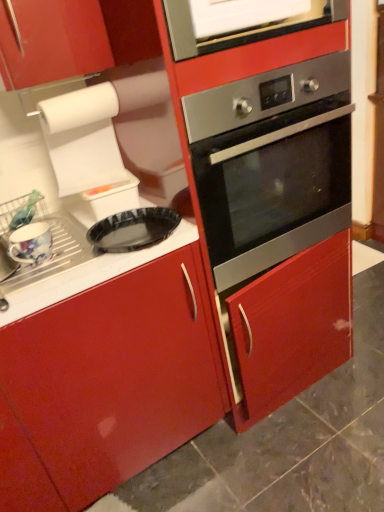
Question: Considering their positions, is stainless steel oven at center located in front of or behind white glossy vent at upper center?

Choices:
 (A) front
 (B) behind

Answer: (B)

Question: Would you say stainless steel oven at center is to the left or to the right of white glossy vent at upper center in the picture?

Choices:
 (A) right
 (B) left

Answer: (A)

Question: Estimate the real-world distances between objects in this image. Which object is farther from the white glossy vent at upper center?

Choices:
 (A) floral ceramic mug at left
 (B) black glossy pizza pan at center
 (C) stainless steel oven at center

Answer: (A)

Question: Based on their relative distances, which object is nearer to the stainless steel oven at center?

Choices:
 (A) white glossy vent at upper center
 (B) floral ceramic mug at left
 (C) black glossy pizza pan at center

Answer: (C)